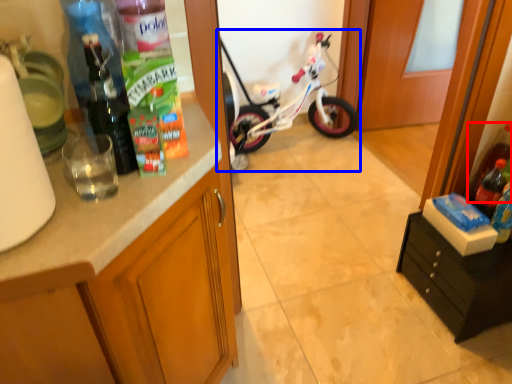
Question: Which of the following is the farthest to the observer, bottle (highlighted by a red box) or bicycle (highlighted by a blue box)?

Choices:
 (A) bottle
 (B) bicycle

Answer: (B)